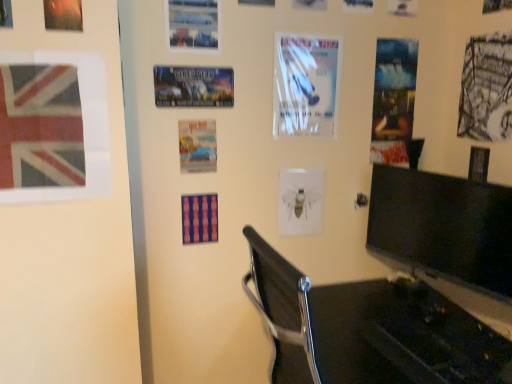
Question: Is matte paper poster at center, the 2th poster positioned from the bottom, taller than matte striped poster at center, which is counted as the third poster page, starting from the left?

Choices:
 (A) yes
 (B) no

Answer: (A)

Question: From a real-world perspective, does matte paper poster at center, the fourth poster positioned from the top, stand above matte striped poster at center, placed as the 4th poster page when sorted from front to back?

Choices:
 (A) yes
 (B) no

Answer: (A)

Question: Is matte paper poster at center, the 2th poster positioned from the bottom, not within matte striped poster at center, which is counted as the third poster page, starting from the left?

Choices:
 (A) no
 (B) yes

Answer: (B)

Question: Is matte paper poster at center, the fourth poster positioned from the top, to the right of matte striped poster at center, which appears as the 5th poster page when viewed from the right, from the viewer's perspective?

Choices:
 (A) yes
 (B) no

Answer: (A)

Question: Can you confirm if matte paper poster at center, the fourth poster positioned from the top, is bigger than matte striped poster at center, which is counted as the fourth poster page, starting from the back?

Choices:
 (A) no
 (B) yes

Answer: (A)

Question: From the image's perspective, is matte paper poster at center, the 2th poster positioned from the bottom, positioned above or below white glossy poster at upper center, acting as the 2th poster starting from the top?

Choices:
 (A) below
 (B) above

Answer: (A)

Question: In terms of width, does matte paper poster at center, the fourth poster positioned from the top, look wider or thinner when compared to white glossy poster at upper center, acting as the 2th poster starting from the top?

Choices:
 (A) thin
 (B) wide

Answer: (A)

Question: In the image, is matte paper poster at center, the 2th poster positioned from the bottom, on the left side or the right side of white glossy poster at upper center, acting as the 2th poster starting from the top?

Choices:
 (A) right
 (B) left

Answer: (B)

Question: Is matte paper poster at center, the fourth poster positioned from the top, situated inside white glossy poster at upper center, acting as the 2th poster starting from the top, or outside?

Choices:
 (A) inside
 (B) outside

Answer: (B)

Question: In the image, is matte striped poster at center, which is counted as the third poster page, starting from the left, on the left side or the right side of black glossy monitor at right?

Choices:
 (A) right
 (B) left

Answer: (B)

Question: Considering their positions, is matte striped poster at center, which is counted as the third poster page, starting from the left, located in front of or behind black glossy monitor at right?

Choices:
 (A) front
 (B) behind

Answer: (B)

Question: Choose the correct answer: Is matte striped poster at center, placed as the 4th poster page when sorted from front to back, inside black glossy monitor at right or outside it?

Choices:
 (A) outside
 (B) inside

Answer: (A)

Question: From a real-world perspective, is matte striped poster at center, placed as the 4th poster page when sorted from front to back, above or below black glossy monitor at right?

Choices:
 (A) below
 (B) above

Answer: (A)

Question: Considering the positions of white glossy poster at upper center, which is the 2th poster page from back to front, and white glossy poster at upper center, acting as the fourth poster starting from the bottom, in the image, is white glossy poster at upper center, which is the 2th poster page from back to front, wider or thinner than white glossy poster at upper center, acting as the fourth poster starting from the bottom,?

Choices:
 (A) wide
 (B) thin

Answer: (B)

Question: Considering their positions, is white glossy poster at upper center, which is counted as the second poster page, starting from the right, located in front of or behind white glossy poster at upper center, acting as the fourth poster starting from the bottom?

Choices:
 (A) behind
 (B) front

Answer: (A)